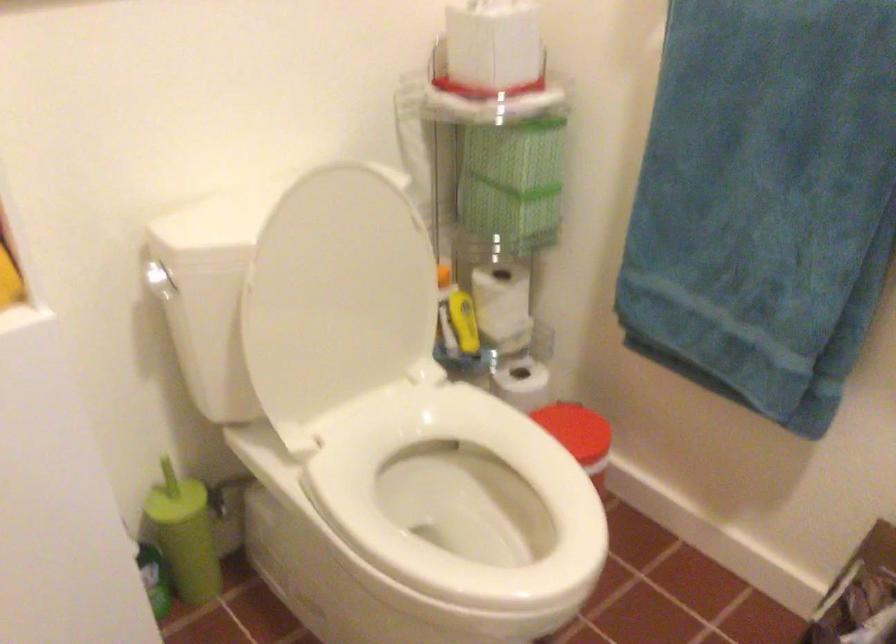
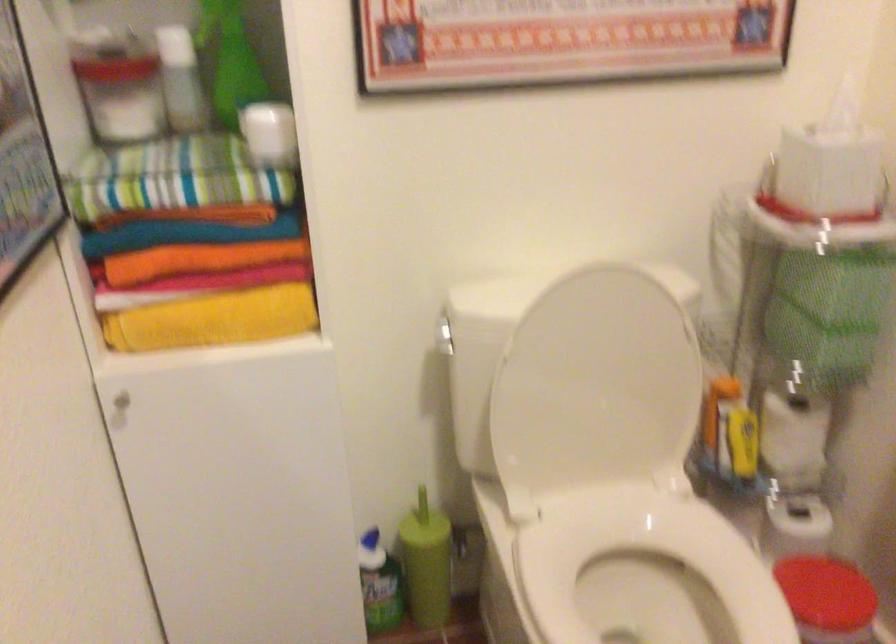
Locate, in the second image, the point that corresponds to the point at 462,319 in the first image.

(743, 440)